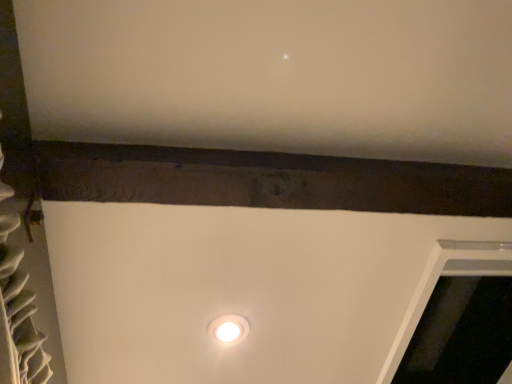
This screenshot has width=512, height=384. I want to click on white glossy lamp at center, so click(x=229, y=329).

This screenshot has width=512, height=384. Describe the element at coordinates (229, 329) in the screenshot. I see `white glossy lamp at center` at that location.

What are the coordinates of `white glossy lamp at center` in the screenshot? It's located at (229, 329).